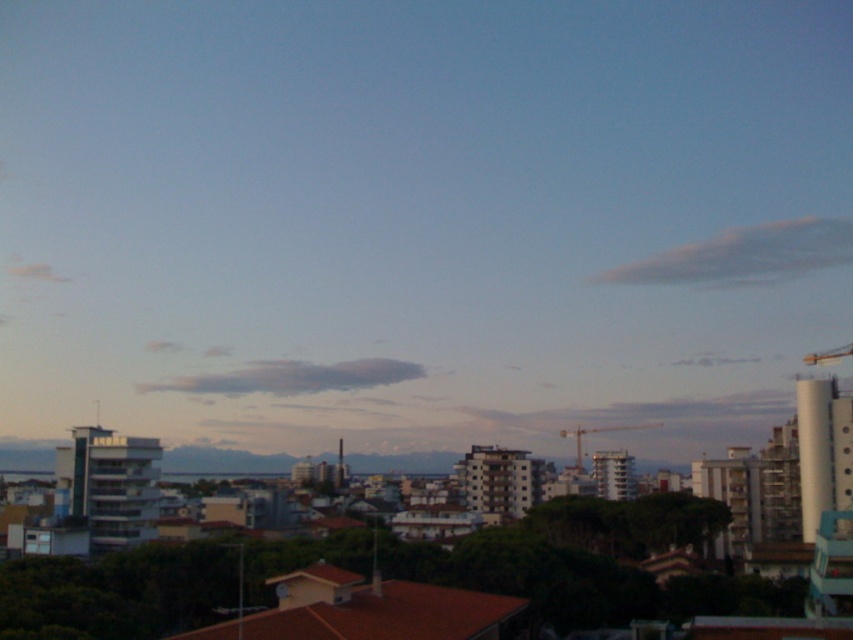
Which is more to the right, metallic construction crane at center or metallic yellow crane at upper right?

metallic yellow crane at upper right

Who is shorter, metallic construction crane at center or metallic yellow crane at upper right?

metallic yellow crane at upper right is shorter.

Is point (657, 426) closer to viewer compared to point (825, 353)?

No, it is not.

Image resolution: width=853 pixels, height=640 pixels. In order to click on metallic construction crane at center in this screenshot , I will do `click(598, 433)`.